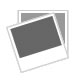
Identify the location of polaroid pictures. This screenshot has width=80, height=80. (39, 29), (61, 16).